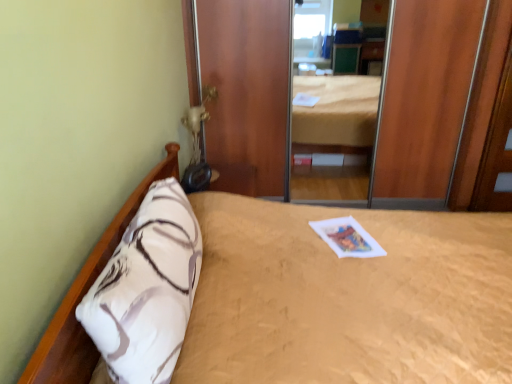
The width and height of the screenshot is (512, 384). In order to click on wooden door at right in this screenshot , I will do `click(497, 151)`.

Identify the location of white soft pillow at left. This screenshot has height=384, width=512. (147, 289).

Where is `beige textured bed at center`? beige textured bed at center is located at coordinates (348, 298).

Is wooden door at right facing towards beige textured bed at center?

No, wooden door at right is not turned towards beige textured bed at center.

Considering the sizes of objects wooden door at right and beige textured bed at center in the image provided, who is smaller, wooden door at right or beige textured bed at center?

wooden door at right.

The width and height of the screenshot is (512, 384). Find the location of `door behind the beige textured bed at center`. door behind the beige textured bed at center is located at coordinates (497, 151).

Is beige textured bed at center a part of wooden door at right?

No.

Can you confirm if white soft pillow at left is taller than wooden door at right?

In fact, white soft pillow at left may be shorter than wooden door at right.

Which object is positioned more to the left, white soft pillow at left or wooden door at right?

From the viewer's perspective, white soft pillow at left appears more on the left side.

From the image's perspective, is white soft pillow at left beneath wooden door at right?

Yes, from the image's perspective, white soft pillow at left is beneath wooden door at right.

Between white paper magazine at center and beige textured bed at center, which one has less height?

Standing shorter between the two is white paper magazine at center.

Between white paper magazine at center and beige textured bed at center, which one has larger width?

beige textured bed at center is wider.

From the picture: Which object is more forward, white paper magazine at center or beige textured bed at center?

beige textured bed at center is more forward.

Locate an element on the screen. magazine above the beige textured bed at center (from the image's perspective) is located at coordinates (347, 238).

From their relative heights in the image, would you say beige textured bed at center is taller or shorter than white paper magazine at center?

Clearly, beige textured bed at center is taller compared to white paper magazine at center.

Considering the relative positions of beige textured bed at center and white paper magazine at center in the image provided, is beige textured bed at center behind white paper magazine at center?

No, the depth of beige textured bed at center is less than that of white paper magazine at center.

Which of these two, white paper magazine at center or white soft pillow at left, stands taller?

white soft pillow at left is taller.

Which is more distant, (383, 249) or (168, 282)?

Positioned behind is point (383, 249).

From the image's perspective, relative to white soft pillow at left, is white paper magazine at center above or below?

Based on their image positions, white paper magazine at center is located above white soft pillow at left.

Does beige textured bed at center have a larger size compared to wooden door at right?

Yes, beige textured bed at center is bigger than wooden door at right.

From the image's perspective, which object appears higher, beige textured bed at center or wooden door at right?

wooden door at right.

Considering the positions of point (439, 291) and point (503, 185), is point (439, 291) closer or farther from the camera than point (503, 185)?

Point (439, 291) appears to be closer to the viewer than point (503, 185).

Considering the relative sizes of beige textured bed at center and wooden door at right in the image provided, is beige textured bed at center wider than wooden door at right?

Correct, the width of beige textured bed at center exceeds that of wooden door at right.

From the image's perspective, which is below, beige textured bed at center or white soft pillow at left?

beige textured bed at center appears lower in the image.

Between beige textured bed at center and white soft pillow at left, which one has less height?

white soft pillow at left.

Is beige textured bed at center directly adjacent to white soft pillow at left?

No.

Where is `door to the right of beige textured bed at center`? This screenshot has width=512, height=384. door to the right of beige textured bed at center is located at coordinates (497, 151).

This screenshot has height=384, width=512. Identify the location of door behind the white soft pillow at left. (497, 151).

Looking at the image, which one is located further to beige textured bed at center, wooden door at right or white soft pillow at left?

wooden door at right is further to beige textured bed at center.

Considering their positions, is white soft pillow at left positioned further to white paper magazine at center than wooden door at right?

The object further to white paper magazine at center is wooden door at right.

Considering their positions, is wooden door at right positioned closer to white soft pillow at left than beige textured bed at center?

The object closer to white soft pillow at left is beige textured bed at center.

Estimate the real-world distances between objects in this image. Which object is further from beige textured bed at center, white paper magazine at center or white soft pillow at left?

white paper magazine at center lies further to beige textured bed at center than the other object.

Looking at the image, which one is located closer to white soft pillow at left, white paper magazine at center or wooden door at right?

white paper magazine at center is positioned closer to the anchor white soft pillow at left.

Which object lies further to the anchor point white soft pillow at left, beige textured bed at center or wooden door at right?

wooden door at right.

When comparing their distances from white paper magazine at center, does wooden door at right or white soft pillow at left seem further?

Based on the image, wooden door at right appears to be further to white paper magazine at center.

Considering their positions, is white soft pillow at left positioned closer to beige textured bed at center than wooden door at right?

white soft pillow at left.

Identify the location of pillow positioned between beige textured bed at center and wooden door at right from near to far. (147, 289).

Identify the location of pillow between beige textured bed at center and white paper magazine at center in the front-back direction. (147, 289).

Identify the location of magazine between beige textured bed at center and wooden door at right in the front-back direction. The width and height of the screenshot is (512, 384). (347, 238).

Identify the location of magazine between white soft pillow at left and wooden door at right in the horizontal direction. This screenshot has width=512, height=384. (347, 238).